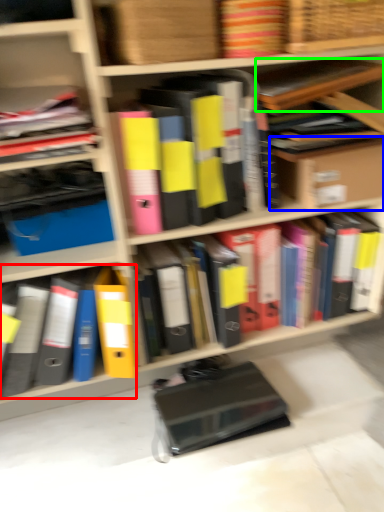
Question: Considering the real-world distances, which object is farthest from book (highlighted by a red box)? cardboard box (highlighted by a blue box) or book (highlighted by a green box)?

Choices:
 (A) cardboard box
 (B) book

Answer: (B)